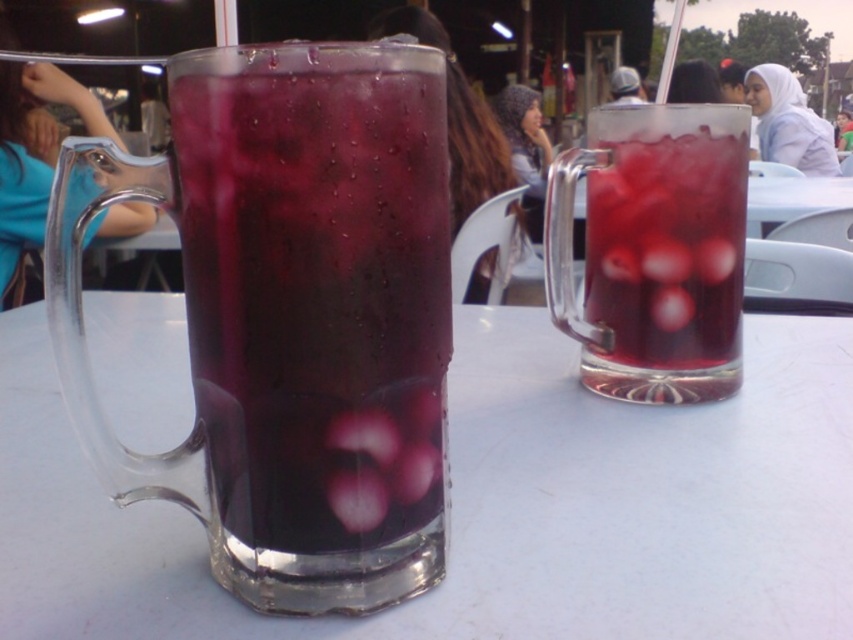
Question: Can you confirm if transparent glass mug at center is positioned to the right of translucent glass mug at center?

Choices:
 (A) no
 (B) yes

Answer: (A)

Question: Can you confirm if transparent glass mug at center is bigger than translucent glass mug at center?

Choices:
 (A) no
 (B) yes

Answer: (B)

Question: Which object appears closest to the camera in this image?

Choices:
 (A) translucent glass mug at center
 (B) dark purple glass at left
 (C) transparent glass mug at center

Answer: (B)

Question: Observing the image, what is the correct spatial positioning of transparent glass mug at center in reference to translucent glass mug at center?

Choices:
 (A) above
 (B) below

Answer: (B)

Question: Which object is closer to the camera taking this photo?

Choices:
 (A) dark purple glass at left
 (B) translucent glass mug at center

Answer: (A)

Question: Which object is farther from the camera taking this photo?

Choices:
 (A) dark purple glass at left
 (B) translucent glass mug at center

Answer: (B)